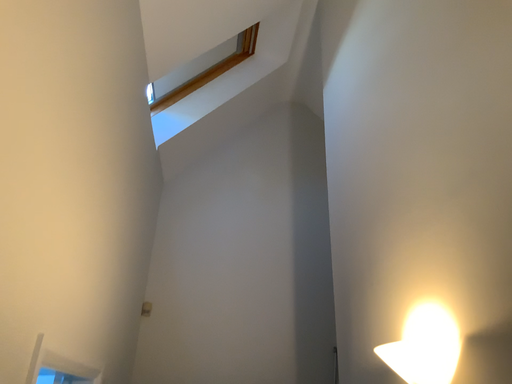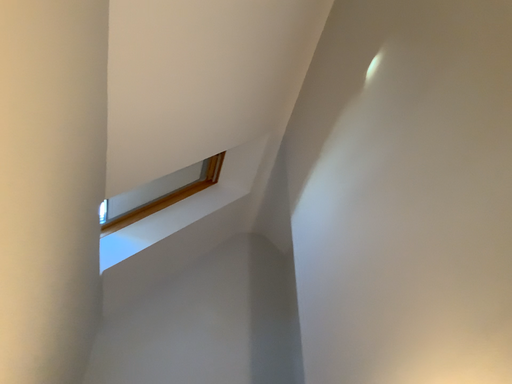
Question: How did the camera likely rotate when shooting the video?

Choices:
 (A) rotated downward
 (B) rotated upward

Answer: (B)